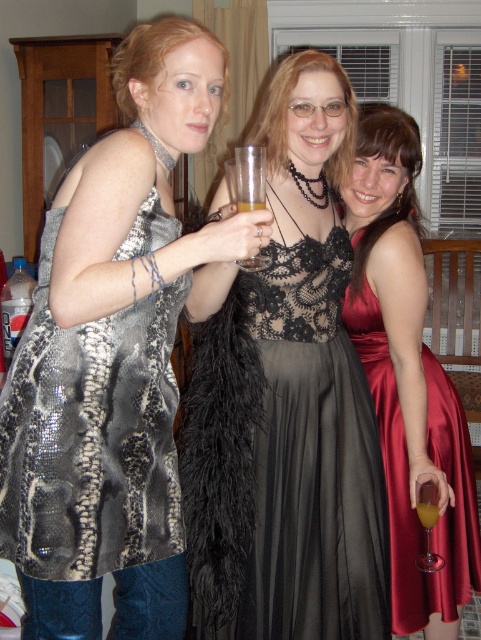
You are a photographer at a party and want to arrange the women so that the shiny metallic dress at center and the satin red dress at right are visible in the photo. Given their heights, which dress should be placed in the front to ensure both are visible?

The satin red dress at right should be placed in the front because the shiny metallic dress at center is much taller, so positioning the shorter one forward will allow both to be visible in the photo.

You are a photographer at a party and need to capture a shot of the shiny metallic dress at center and the translucent plastic cup at center. The camera has a minimum focus distance of 12 inches. Will you be able to focus on both objects without moving the camera?

The distance between the shiny metallic dress at center and the translucent plastic cup at center is 11.65 inches, which is less than the camera minimum focus distance of 12 inches. Therefore, the camera cannot focus on both objects simultaneously without moving the camera closer or adjusting the focus.